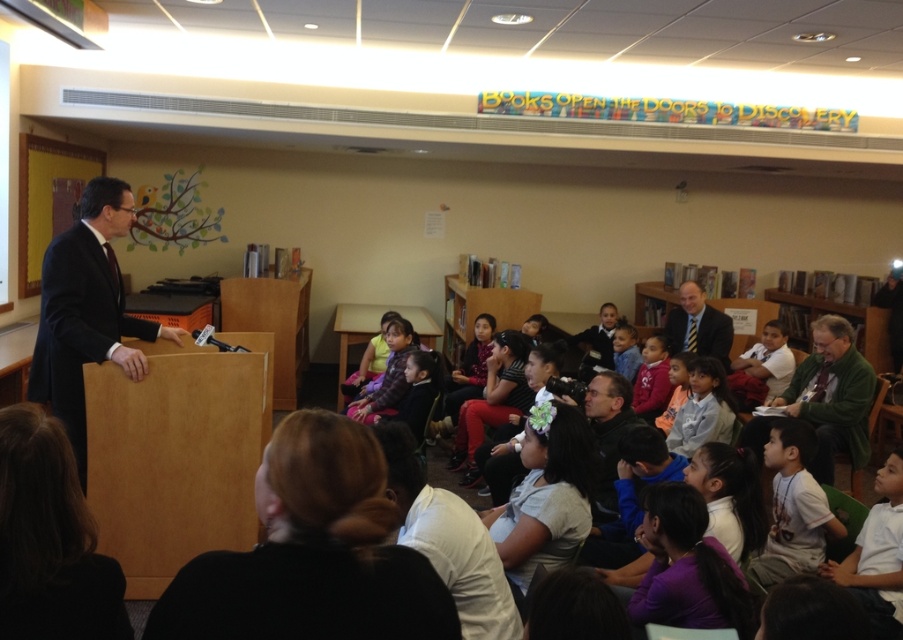
How much distance is there between black suit at left and pink fabric dress at center?

They are 8.58 feet apart.

Can you confirm if black suit at left is taller than pink fabric dress at center?

Yes, black suit at left is taller than pink fabric dress at center.

Is point (70, 346) behind point (380, 323)?

That is False.

Locate an element on the screen. black suit at left is located at coordinates (86, 310).

Who is positioned more to the right, matte pink hoodie at center or pink fabric dress at center?

matte pink hoodie at center is more to the right.

Does matte pink hoodie at center lie behind pink fabric dress at center?

That is False.

Where is `matte pink hoodie at center`? This screenshot has width=903, height=640. matte pink hoodie at center is located at coordinates (652, 380).

Identify the location of matte pink hoodie at center. (652, 380).

Can you confirm if green wool sweater at right is bigger than light brown shirt at center?

Yes.

What do you see at coordinates (831, 396) in the screenshot?
I see `green wool sweater at right` at bounding box center [831, 396].

Find the location of a particular element. This screenshot has width=903, height=640. green wool sweater at right is located at coordinates (831, 396).